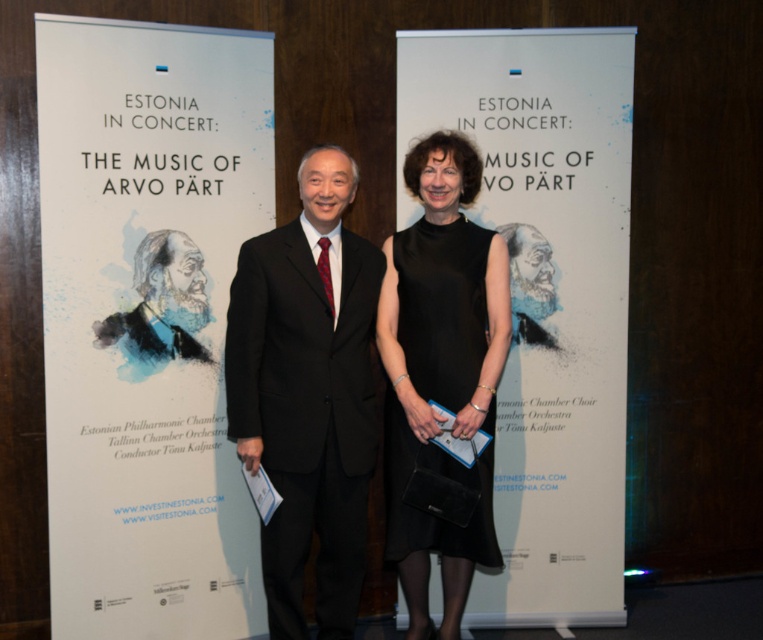
Question: Which point is farther to the camera?

Choices:
 (A) (404, 38)
 (B) (396, 408)
 (C) (98, 566)

Answer: (A)

Question: Is black suit at center bigger than black satin dress at center?

Choices:
 (A) yes
 (B) no

Answer: (A)

Question: Does white paper at center have a smaller size compared to black suit at center?

Choices:
 (A) no
 (B) yes

Answer: (A)

Question: Does white paper at center have a smaller size compared to black satin dress at center?

Choices:
 (A) no
 (B) yes

Answer: (A)

Question: Which of the following is the farthest from the observer?

Choices:
 (A) pyautogui.click(x=84, y=524)
 (B) pyautogui.click(x=240, y=250)
 (C) pyautogui.click(x=498, y=604)
 (D) pyautogui.click(x=406, y=284)

Answer: (C)

Question: Which point is closer to the camera taking this photo?

Choices:
 (A) (261, 44)
 (B) (559, 44)

Answer: (A)